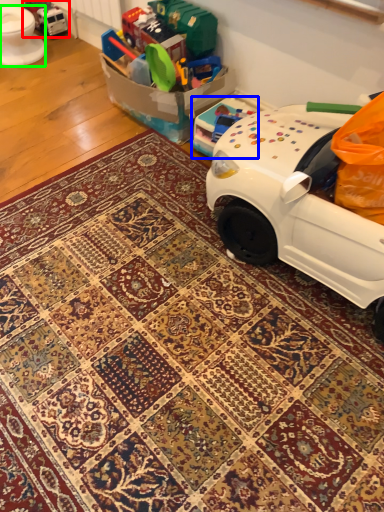
Question: Which object is positioned farthest from toy (highlighted by a red box)? Select from toy (highlighted by a blue box) and toilet bowl (highlighted by a green box).

Choices:
 (A) toy
 (B) toilet bowl

Answer: (A)